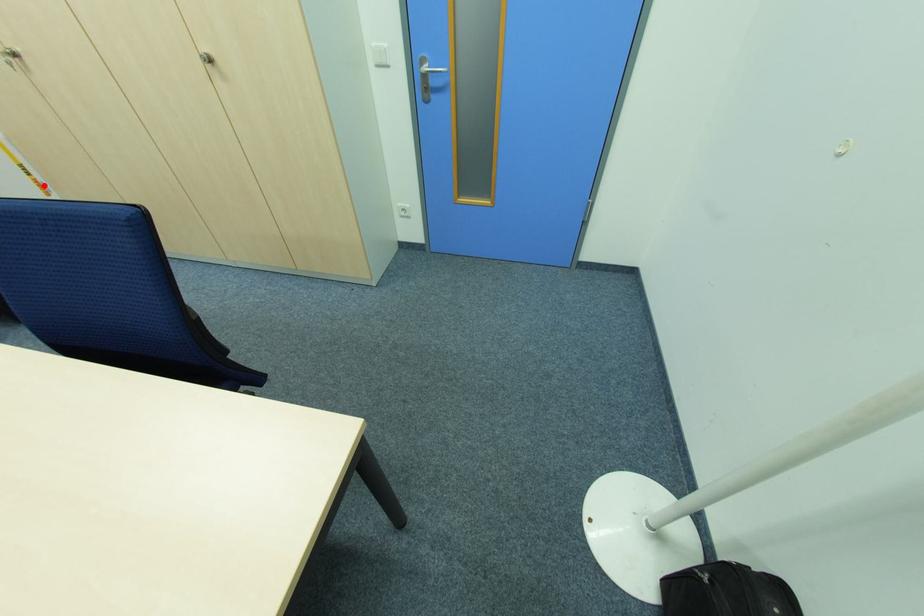
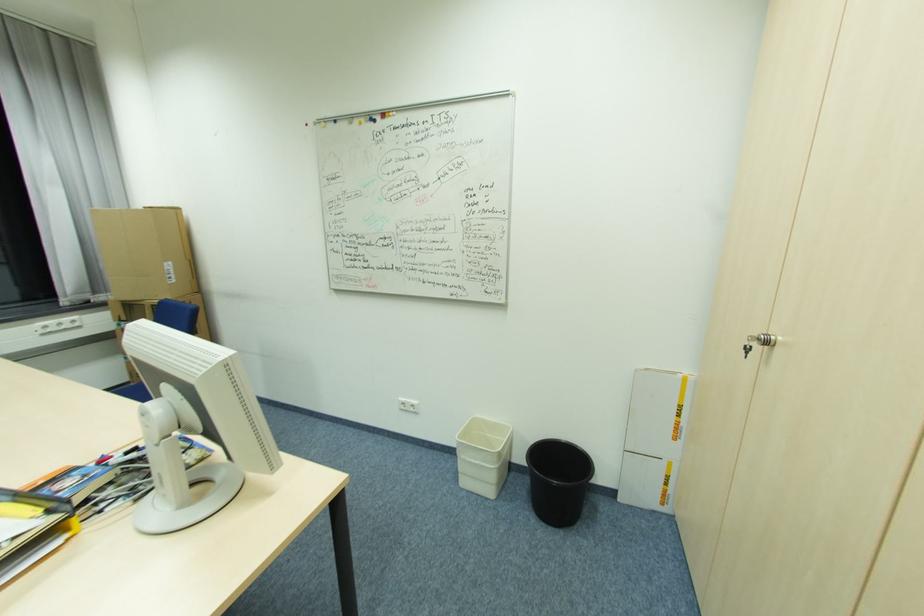
Question: I am providing you with two images of the same scene from different viewpoints. Given a red point in image1, look at the same physical point in image2. Is it:

Choices:
 (A) Closer to the viewpoint
 (B) Farther from the viewpoint

Answer: (A)